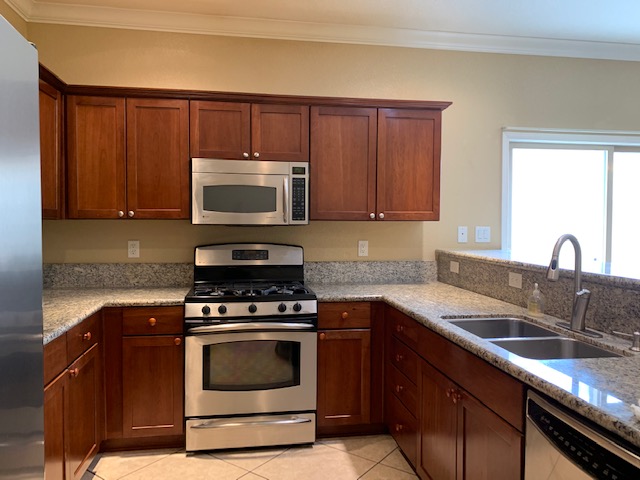
You are a GUI agent. You are given a task and a screenshot of the screen. Output one action in this format:
    pyautogui.click(x=<x>, y=<y>)
    Task: Click on the lower cabinet doors
    The width and height of the screenshot is (640, 480).
    Given the screenshot: What is the action you would take?
    pyautogui.click(x=77, y=424), pyautogui.click(x=148, y=391), pyautogui.click(x=345, y=371), pyautogui.click(x=441, y=424), pyautogui.click(x=499, y=458)